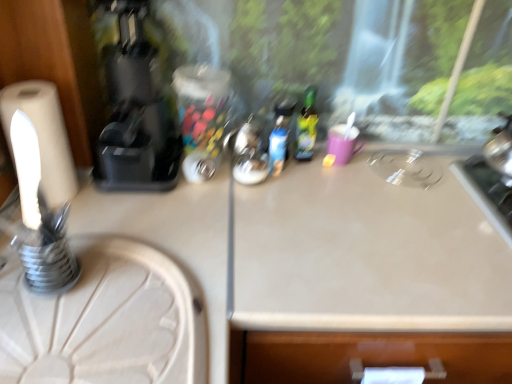
Question: Is black plastic coffee machine at left far away from white matte toilet paper at left?

Choices:
 (A) yes
 (B) no

Answer: (B)

Question: Does black plastic coffee machine at left have a smaller size compared to white matte toilet paper at left?

Choices:
 (A) no
 (B) yes

Answer: (A)

Question: From the image's perspective, would you say black plastic coffee machine at left is positioned over white matte toilet paper at left?

Choices:
 (A) yes
 (B) no

Answer: (A)

Question: Would you say black plastic coffee machine at left is outside white matte toilet paper at left?

Choices:
 (A) yes
 (B) no

Answer: (A)

Question: Does black plastic coffee machine at left have a lesser height compared to white matte toilet paper at left?

Choices:
 (A) no
 (B) yes

Answer: (A)

Question: From a real-world perspective, is white matte toilet paper at left physically located above or below matte plastic bottle at center, which is the 1th bottle from left to right?

Choices:
 (A) below
 (B) above

Answer: (B)

Question: Considering their positions, is white matte toilet paper at left located in front of or behind matte plastic bottle at center, which is the 2th bottle from right to left?

Choices:
 (A) behind
 (B) front

Answer: (B)

Question: Is white matte toilet paper at left inside the boundaries of matte plastic bottle at center, which is the 1th bottle from left to right, or outside?

Choices:
 (A) outside
 (B) inside

Answer: (A)

Question: From the image's perspective, is white matte toilet paper at left located above or below matte plastic bottle at center, which is the 1th bottle from left to right?

Choices:
 (A) above
 (B) below

Answer: (B)

Question: Visually, is black plastic coffee machine at left positioned to the left or to the right of green glass bottle at center, which is counted as the first bottle, starting from the right?

Choices:
 (A) right
 (B) left

Answer: (B)

Question: Is black plastic coffee machine at left inside or outside of green glass bottle at center, which is counted as the first bottle, starting from the right?

Choices:
 (A) inside
 (B) outside

Answer: (B)

Question: Considering the positions of black plastic coffee machine at left and green glass bottle at center, the second bottle positioned from the left, in the image, is black plastic coffee machine at left wider or thinner than green glass bottle at center, the second bottle positioned from the left,?

Choices:
 (A) wide
 (B) thin

Answer: (A)

Question: Is black plastic coffee machine at left taller or shorter than green glass bottle at center, the second bottle positioned from the left?

Choices:
 (A) tall
 (B) short

Answer: (A)

Question: Is black plastic coffee machine at left wider or thinner than white wood round table at lower left?

Choices:
 (A) thin
 (B) wide

Answer: (A)

Question: Considering the positions of point (110, 165) and point (180, 309), is point (110, 165) closer or farther from the camera than point (180, 309)?

Choices:
 (A) farther
 (B) closer

Answer: (A)